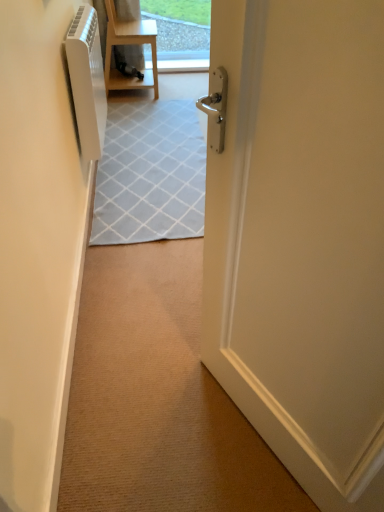
Question: From a real-world perspective, is white glossy radiator at left located beneath white glossy door at center?

Choices:
 (A) no
 (B) yes

Answer: (A)

Question: Could you tell me if white glossy radiator at left is turned towards white glossy door at center?

Choices:
 (A) no
 (B) yes

Answer: (A)

Question: Would you say white glossy radiator at left contains white glossy door at center?

Choices:
 (A) yes
 (B) no

Answer: (B)

Question: Can you confirm if white glossy radiator at left is taller than white glossy door at center?

Choices:
 (A) no
 (B) yes

Answer: (B)

Question: Is the position of white glossy radiator at left more distant than that of white glossy door at center?

Choices:
 (A) no
 (B) yes

Answer: (A)

Question: Choose the correct answer: Is white plastic air conditioner at left inside white glossy door at center or outside it?

Choices:
 (A) inside
 (B) outside

Answer: (B)

Question: From a real-world perspective, relative to white glossy door at center, is white plastic air conditioner at left vertically above or below?

Choices:
 (A) below
 (B) above

Answer: (B)

Question: Is white plastic air conditioner at left bigger or smaller than white glossy door at center?

Choices:
 (A) big
 (B) small

Answer: (B)

Question: Visually, is white plastic air conditioner at left positioned to the left or to the right of white glossy door at center?

Choices:
 (A) left
 (B) right

Answer: (A)

Question: From a real-world perspective, is white glossy radiator at left positioned above or below white glossy door at center?

Choices:
 (A) below
 (B) above

Answer: (B)

Question: Is white glossy radiator at left wider or thinner than white glossy door at center?

Choices:
 (A) thin
 (B) wide

Answer: (A)

Question: Is white glossy radiator at left in front of or behind white glossy door at center in the image?

Choices:
 (A) front
 (B) behind

Answer: (A)

Question: Would you say white glossy radiator at left is to the left or to the right of white glossy door at center in the picture?

Choices:
 (A) right
 (B) left

Answer: (B)

Question: Is light wood/matte chair at upper center situated inside white glossy door at center or outside?

Choices:
 (A) inside
 (B) outside

Answer: (B)

Question: Considering the positions of point (135, 87) and point (382, 391), is point (135, 87) closer or farther from the camera than point (382, 391)?

Choices:
 (A) farther
 (B) closer

Answer: (A)